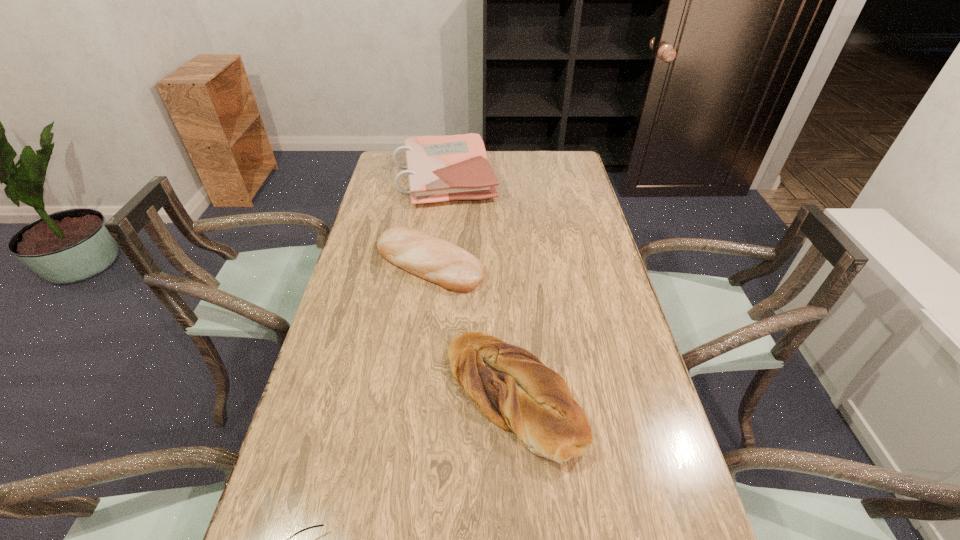
Find the location of `object that is positioned at the far left corner`. object that is positioned at the far left corner is located at coordinates (440, 168).

This screenshot has width=960, height=540. I want to click on free space at the far edge of the desktop, so click(x=504, y=160).

Where is `blank space at the left edge of the desktop`? The width and height of the screenshot is (960, 540). blank space at the left edge of the desktop is located at coordinates (278, 511).

Identify the location of vacant space at the right edge of the desktop. (589, 252).

Identify the location of vacant area that lies between the farthest object and the second farthest object. Image resolution: width=960 pixels, height=540 pixels. (437, 221).

At what (x,y) coordinates should I click in order to perform the action: click on unoccupied position between the second farthest object and the third farthest object. Please return your answer as a coordinate pair (x, y). Looking at the image, I should click on (471, 330).

Identify the location of vacant area between the phonebook and the nearer bread. This screenshot has height=540, width=960. (479, 287).

Locate an element on the screen. free area in between the phonebook and the second nearest object is located at coordinates (479, 287).

Where is `free area in between the farther bread and the farthest object`? free area in between the farther bread and the farthest object is located at coordinates click(437, 221).

Where is `unoccupied position between the second farthest object and the nearer bread`? This screenshot has height=540, width=960. unoccupied position between the second farthest object and the nearer bread is located at coordinates (471, 330).